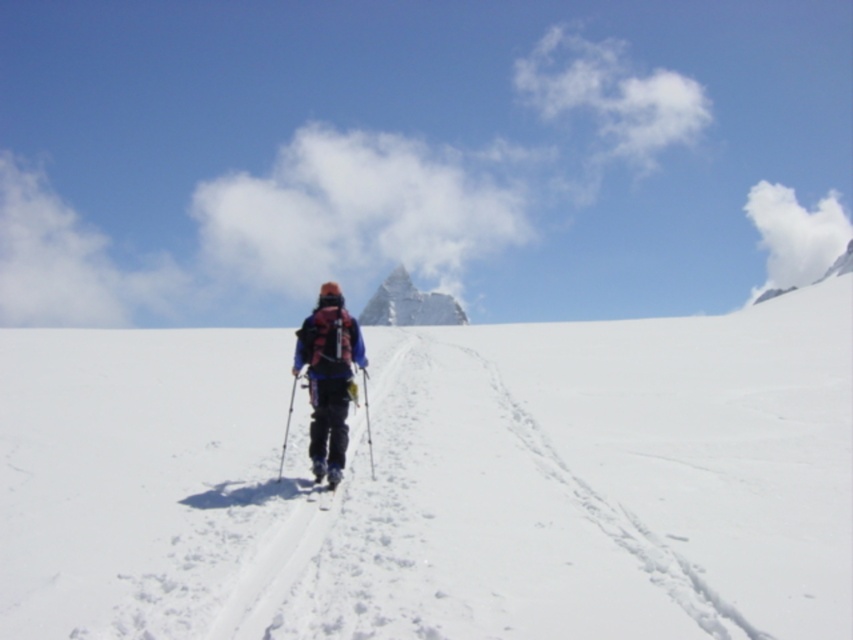
Is black matte ski at center taller than white matte ski at center?

Yes, black matte ski at center is taller than white matte ski at center.

Measure the distance between point (322,480) and camera.

A distance of 44.15 feet exists between point (322,480) and camera.

Where is `black matte ski at center`? black matte ski at center is located at coordinates (323, 484).

Which of these two, white fluffy cloud at upper center or metallic ski pole at center, stands taller?

white fluffy cloud at upper center is taller.

Who is more distant from viewer, (281,260) or (369,456)?

The point (281,260) is behind.

Where is `white fluffy cloud at upper center`? This screenshot has height=640, width=853. white fluffy cloud at upper center is located at coordinates [355, 212].

Can you confirm if matte pink backpack at center is wider than white matte ski at center?

Yes.

Who is more distant from viewer, (335,460) or (337,472)?

The point (335,460) is behind.

Locate an element on the screen. matte pink backpack at center is located at coordinates pyautogui.click(x=328, y=374).